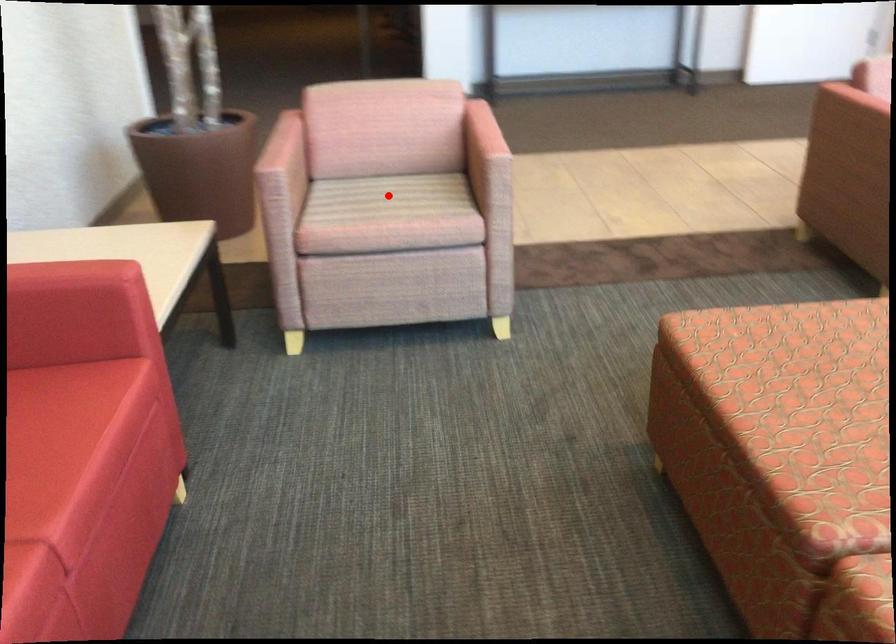
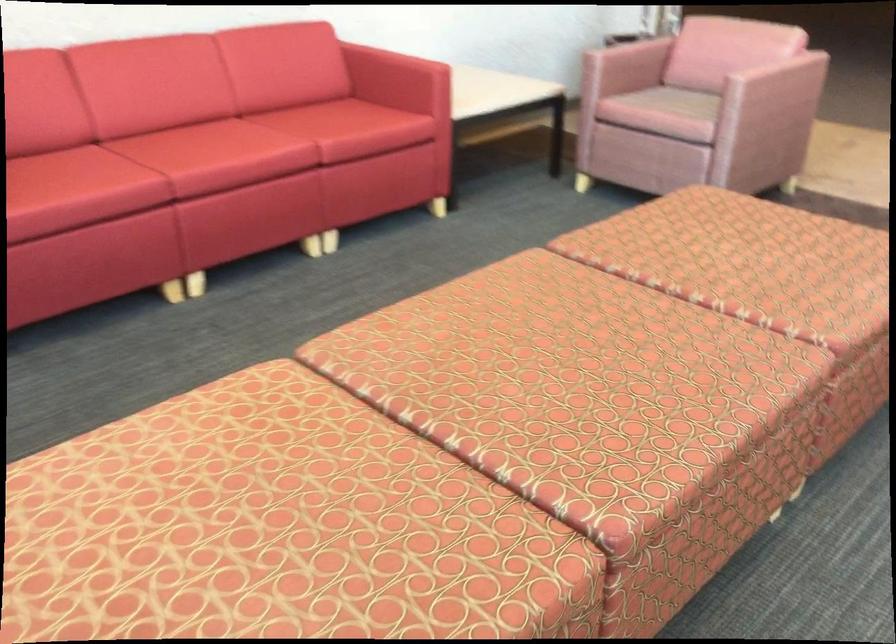
Question: I am providing you with two images of the same scene from different viewpoints. Given a red point in image1, look at the same physical point in image2. Is it:

Choices:
 (A) Closer to the viewpoint
 (B) Farther from the viewpoint

Answer: (B)